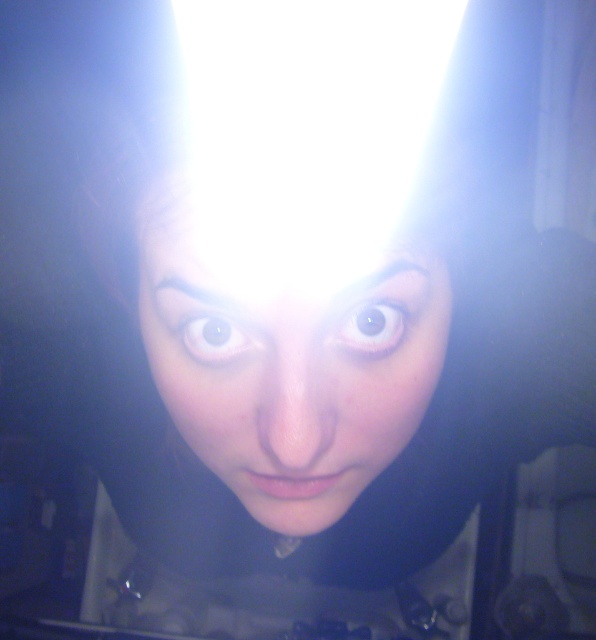
Question: Can you confirm if smooth skin face at center is wider than brown glossy eye at upper center?

Choices:
 (A) yes
 (B) no

Answer: (A)

Question: Which point is closer to the camera taking this photo?

Choices:
 (A) (232, 342)
 (B) (359, 468)
 (C) (396, 314)

Answer: (A)

Question: Among these objects, which one is nearest to the camera?

Choices:
 (A) brown glossy eye at center
 (B) smooth skin face at center
 (C) brown glossy eye at upper center

Answer: (B)

Question: Is smooth skin face at center to the left of brown glossy eye at center from the viewer's perspective?

Choices:
 (A) yes
 (B) no

Answer: (A)

Question: Which point is farther from the camera taking this photo?

Choices:
 (A) tap(232, 352)
 (B) tap(384, 310)
 (C) tap(415, 378)

Answer: (C)

Question: Can you confirm if smooth skin face at center is wider than brown glossy eye at center?

Choices:
 (A) no
 (B) yes

Answer: (B)